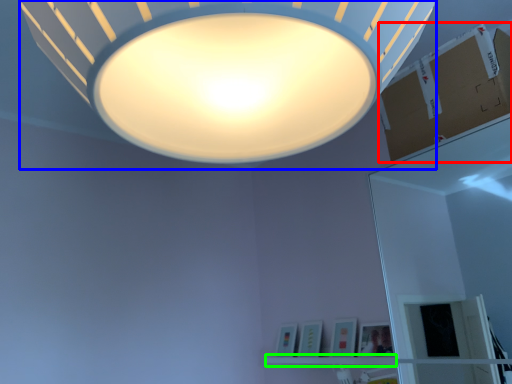
Question: Which is farther away from cardboard box (highlighted by a red box)? lamp (highlighted by a blue box) or shelf (highlighted by a green box)?

Choices:
 (A) lamp
 (B) shelf

Answer: (B)